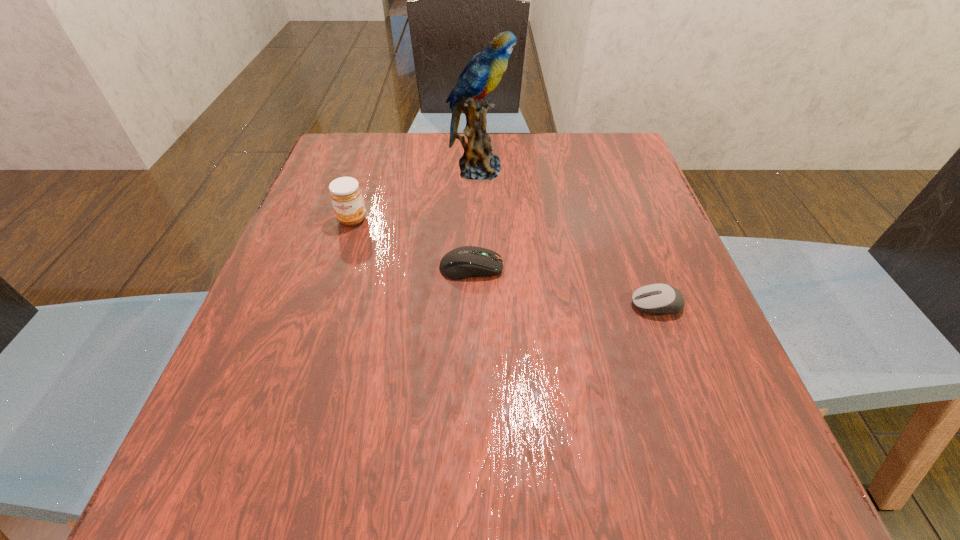
I want to click on free space located 0.170m on the button of the farther computer equipment, so click(x=593, y=267).

Where is `vacant space located on the wheel side of the right computer equipment`? This screenshot has height=540, width=960. vacant space located on the wheel side of the right computer equipment is located at coordinates (453, 305).

Locate an element on the screen. The image size is (960, 540). blank space located 0.050m on the wheel side of the right computer equipment is located at coordinates (602, 305).

Locate an element on the screen. vacant area situated 0.100m on the wheel side of the right computer equipment is located at coordinates (573, 305).

This screenshot has height=540, width=960. In order to click on object at the far edge in this screenshot , I will do `click(482, 74)`.

I want to click on object located in the left edge section of the desktop, so click(345, 193).

Locate an element on the screen. Image resolution: width=960 pixels, height=540 pixels. object present at the right edge is located at coordinates (656, 298).

Find the location of a particular element. free space at the far edge of the desktop is located at coordinates (507, 163).

In order to click on vacant area at the near edge of the desktop in this screenshot , I will do `click(324, 482)`.

The height and width of the screenshot is (540, 960). In order to click on vacant region at the left edge of the desktop in this screenshot , I will do `click(300, 243)`.